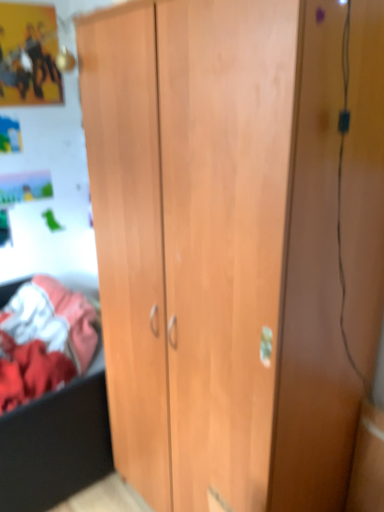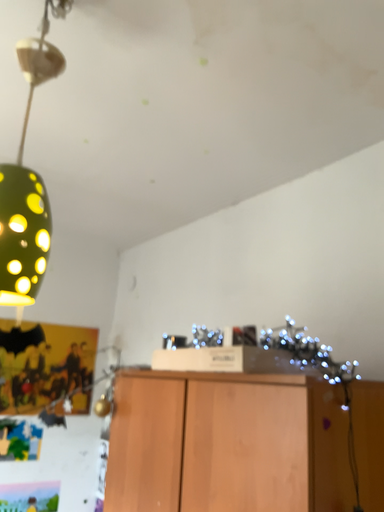
Question: Which way did the camera rotate in the video?

Choices:
 (A) rotated upward
 (B) rotated downward

Answer: (A)